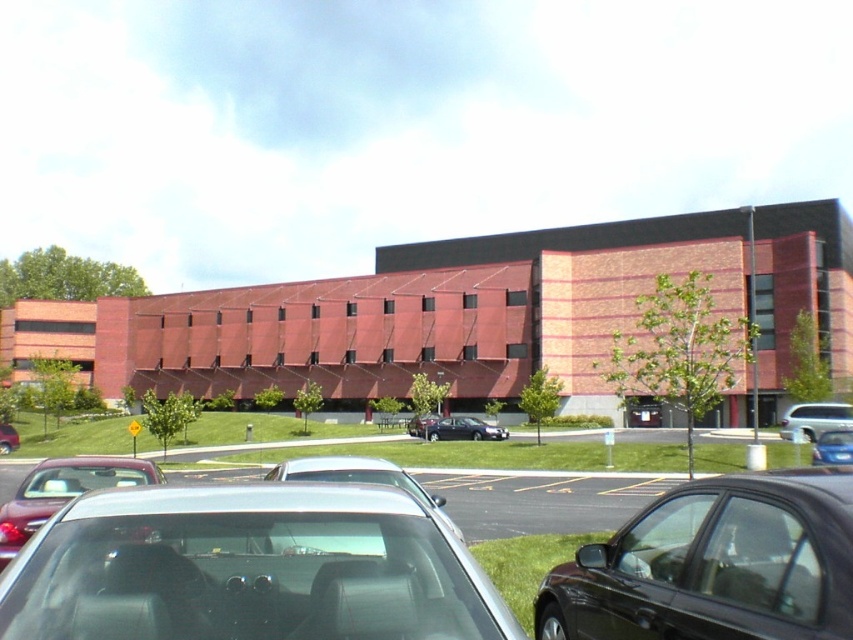
Locate an element on the screen. The width and height of the screenshot is (853, 640). sleek silver sedan at center is located at coordinates (357, 476).

How distant is sleek silver sedan at center from matte black sedan at center?

A distance of 107.58 feet exists between sleek silver sedan at center and matte black sedan at center.

Is point (410, 484) positioned before point (6, 451)?

Yes, it is in front of point (6, 451).

The width and height of the screenshot is (853, 640). In order to click on sleek silver sedan at center in this screenshot , I will do `click(357, 476)`.

Can you confirm if sleek silver sedan at center is positioned above shiny black sedan at center?

Yes, sleek silver sedan at center is above shiny black sedan at center.

Is sleek silver sedan at center thinner than shiny black sedan at center?

Incorrect, sleek silver sedan at center's width is not less than shiny black sedan at center's.

Which is behind, point (334, 458) or point (415, 433)?

Point (415, 433)

I want to click on sleek silver sedan at center, so click(x=357, y=476).

Does matte silver sedan at lower left appear on the right side of satin black sedan at center?

In fact, matte silver sedan at lower left is to the left of satin black sedan at center.

Which is more to the left, matte silver sedan at lower left or satin black sedan at center?

Positioned to the left is matte silver sedan at lower left.

Which is in front, point (20, 483) or point (415, 420)?

Point (20, 483) is in front.

You are a GUI agent. You are given a task and a screenshot of the screen. Output one action in this format:
    pyautogui.click(x=<x>, y=<y>)
    Task: Click on the matte silver sedan at lower left
    The height and width of the screenshot is (640, 853).
    Given the screenshot: What is the action you would take?
    pyautogui.click(x=62, y=492)